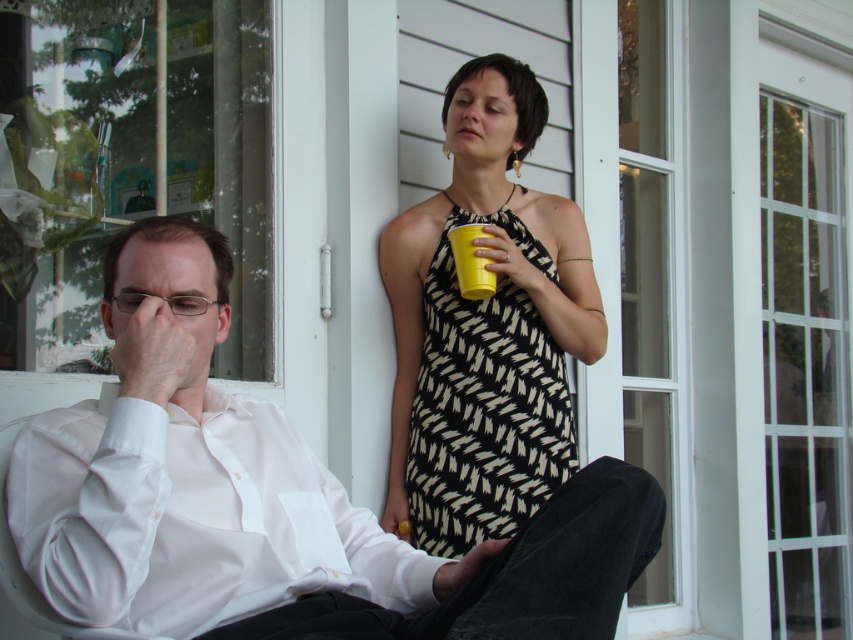
You are a photographer standing in front of the two people. You want to take a photo of both the white smooth shirt at left and the black and white zigzag dress at upper center. Can you fit both in the frame if your camera has a 30 inch field of view?

The white smooth shirt at left is 26.54 inches away from the black and white zigzag dress at upper center. Since the distance between them is less than the camera field of view of 30 inches, both can be captured in the frame.

You are a photographer trying to capture a portrait of both the white cotton shirt at left and the black and white zigzag dress at upper center. Since you want to ensure both are clearly visible, which subject should you focus on first to account for their sizes?

The white cotton shirt at left is bigger than the black and white zigzag dress at upper center, so you should focus on the white cotton shirt at left first to ensure its details are sharp, as larger subjects often require more precise focus to maintain clarity.

You are an artist trying to sketch the scene. The white smooth shirt at left is located at coordinates 0.809 on the x axis and 0.225 on the y axis. If you want to draw the shirt exactly where it is in the image, what coordinates should you use?

The white smooth shirt at left should be drawn at coordinates x 0.809 and y 0.225 to accurately represent its position in the scene.